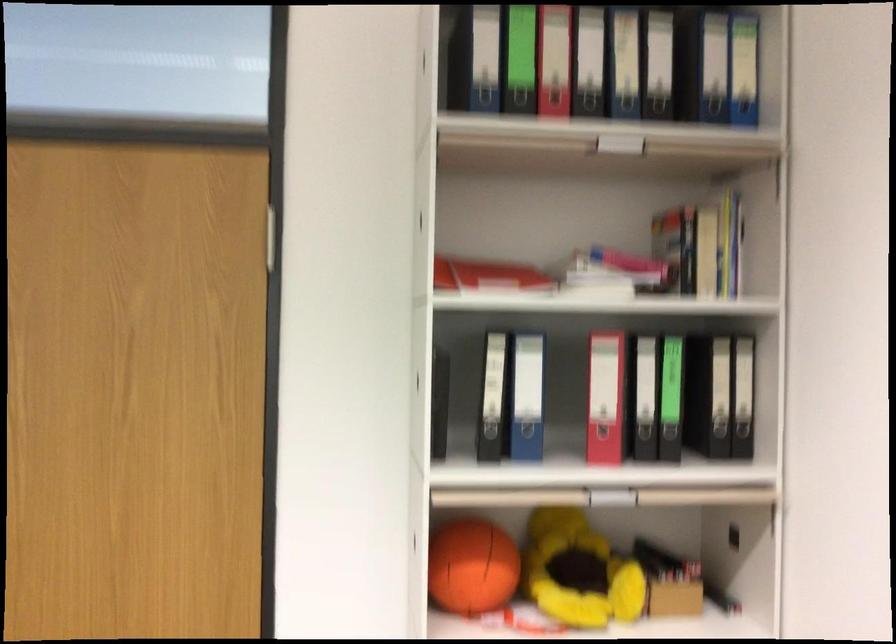
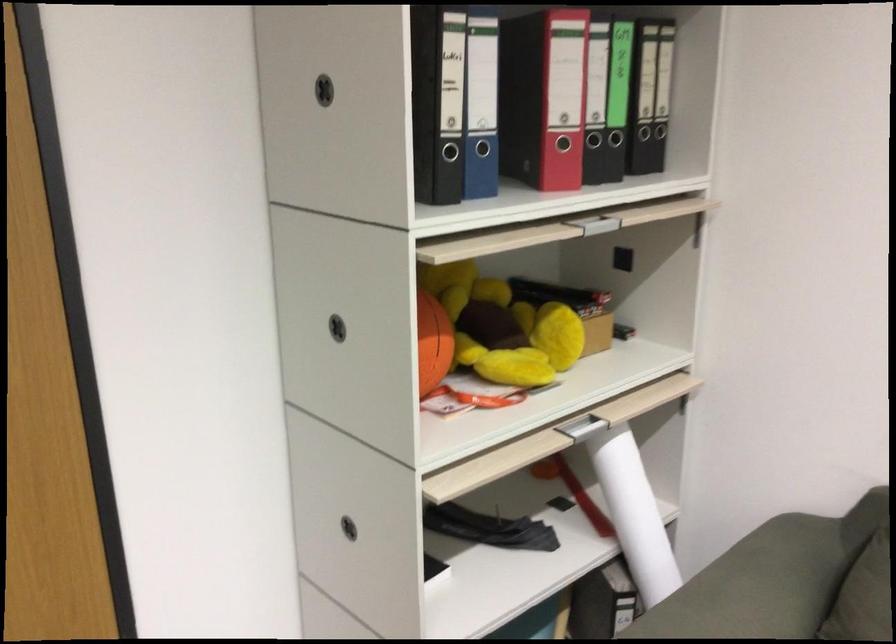
Find the pixel in the second image that matches (810,550) in the first image.

(743, 260)